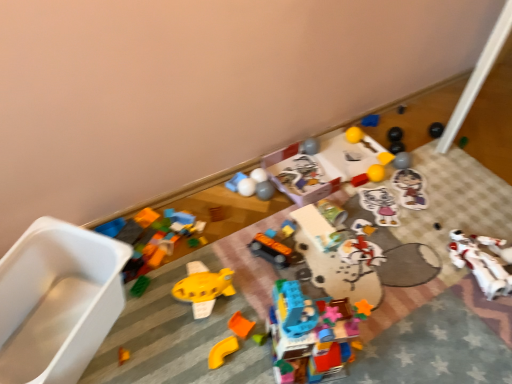
At what (x,y) coordinates should I click in order to perform the action: click on free space in front of orange matte block at center, which ranks as the fifth toy in left-to-right order. Please return your answer as a coordinate pair (x, y). Image resolution: width=512 pixels, height=384 pixels. Looking at the image, I should click on (234, 362).